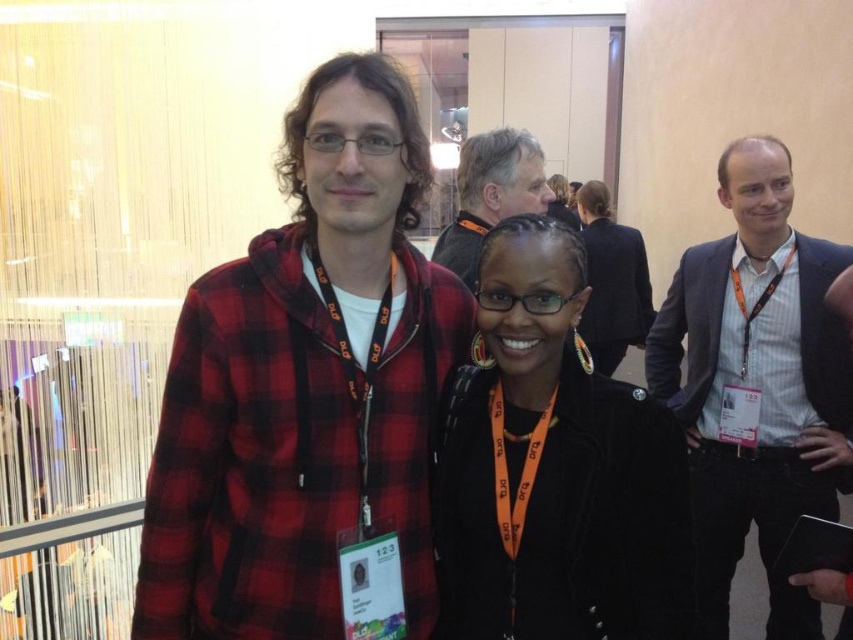
You are a photographer setting up for a group photo. You need to ensure that the red plaid hoodie at center and the light brown hair at upper center are within a 60 cm focal range. Can both subjects be captured clearly in the same shot?

The distance between the red plaid hoodie at center and the light brown hair at upper center is 56.09 centimeters, which is within the 60 cm focal range. Therefore, both subjects can be captured clearly in the same shot.

You are a photographer at this event, and you need to capture a photo of both the red plaid hoodie at center and the black leather jacket at center. Which clothing item should you adjust to ensure both are fully visible in the frame?

The red plaid hoodie at center is shorter than the black leather jacket at center. To ensure both are fully visible, you should lower the camera angle slightly so that the taller black leather jacket at center doesn t block the shorter red plaid hoodie at center.